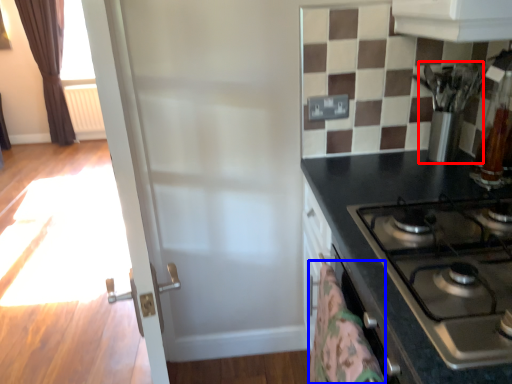
Question: Which object appears closest to the camera in this image, appliance (highlighted by a red box) or blanket (highlighted by a blue box)?

Choices:
 (A) appliance
 (B) blanket

Answer: (B)